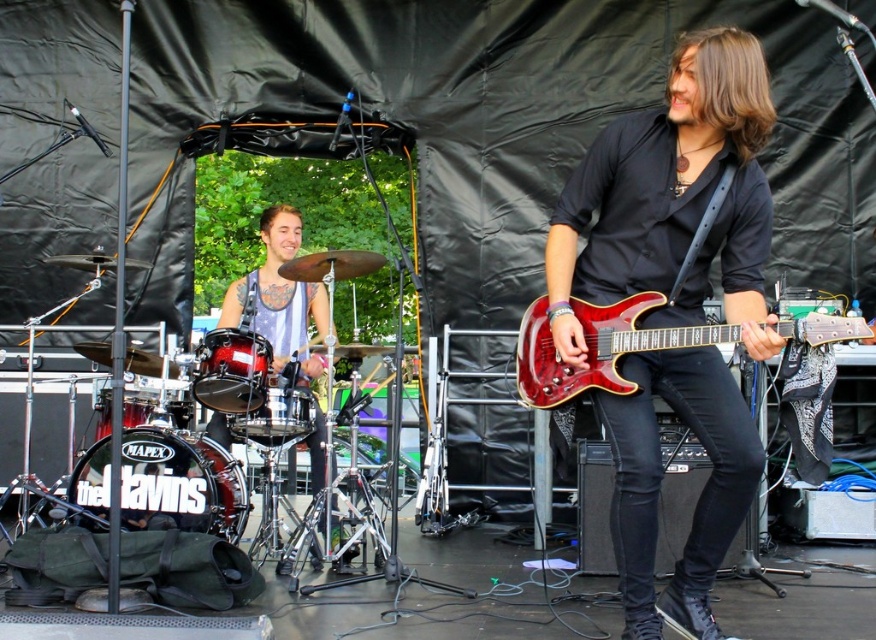
Can you confirm if shiny red guitar at center is wider than glossy wood guitar at center?

No, shiny red guitar at center is not wider than glossy wood guitar at center.

Is point (613, 285) closer to viewer compared to point (634, 339)?

No, it is behind (634, 339).

The width and height of the screenshot is (876, 640). What are the coordinates of `shiny red guitar at center` in the screenshot? It's located at (673, 200).